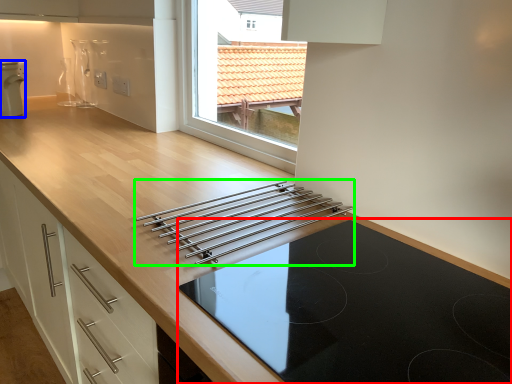
Question: Which object is the farthest from gas stove (highlighted by a red box)? Choose among these: home appliance (highlighted by a blue box) or kitchen appliance (highlighted by a green box).

Choices:
 (A) home appliance
 (B) kitchen appliance

Answer: (A)